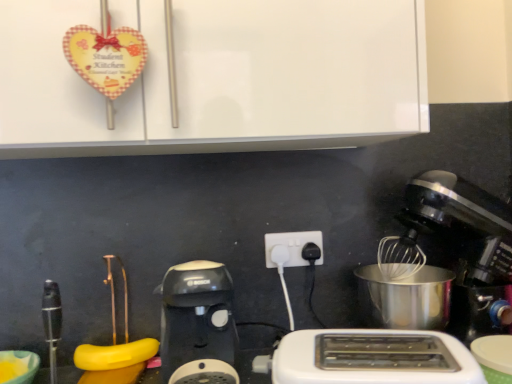
Question: Considering the positions of matte yellow bowl at lower left and white plastic toaster at lower center in the image, is matte yellow bowl at lower left wider or thinner than white plastic toaster at lower center?

Choices:
 (A) thin
 (B) wide

Answer: (B)

Question: From the image's perspective, relative to white plastic toaster at lower center, is matte yellow bowl at lower left above or below?

Choices:
 (A) below
 (B) above

Answer: (A)

Question: Which object is positioned farthest from the white glossy cabinet at upper center?

Choices:
 (A) white plastic toaster at lower center
 (B) metallic silver mixer at right
 (C) black plastic coffee maker at center
 (D) white plastic power plug at center
 (E) matte yellow bowl at lower left

Answer: (E)

Question: Which object is the farthest from the matte yellow bowl at lower left?

Choices:
 (A) white glossy cabinet at upper center
 (B) white plastic power plug at center
 (C) metallic silver mixer at right
 (D) black plastic coffee maker at center
 (E) white plastic toaster at lower center

Answer: (C)